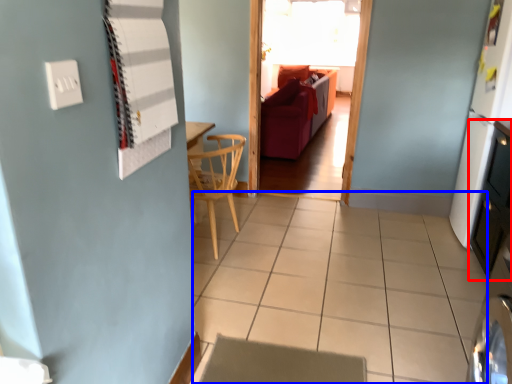
Question: Which of the following is the closest to the observer, dresser (highlighted by a red box) or tile (highlighted by a blue box)?

Choices:
 (A) dresser
 (B) tile

Answer: (B)